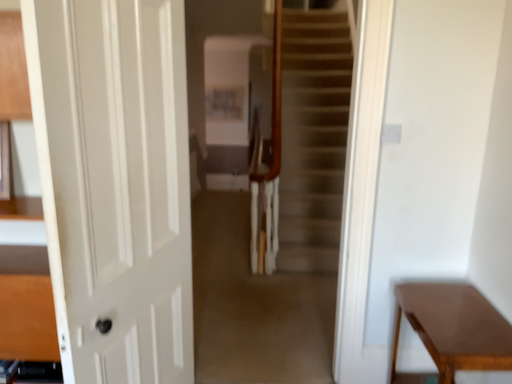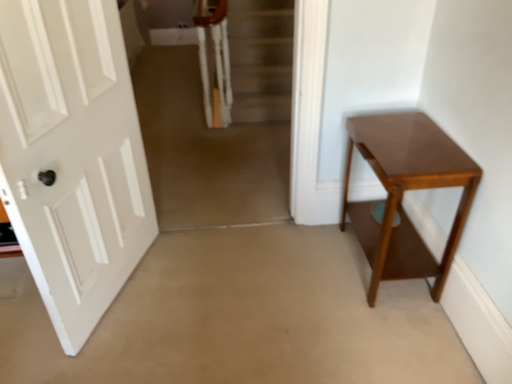
Question: Which way did the camera rotate in the video?

Choices:
 (A) rotated downward
 (B) rotated upward

Answer: (A)